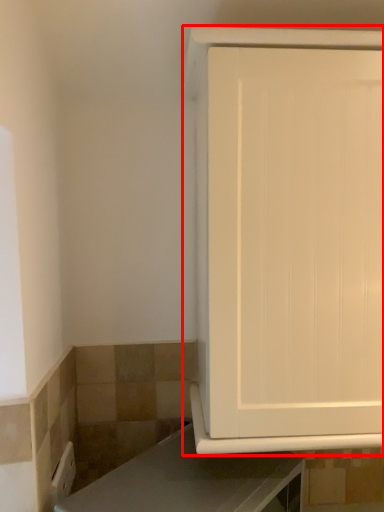
Question: From the image's perspective, what is the correct spatial positioning of cabinetry (annotated by the red box) in reference to countertop?

Choices:
 (A) above
 (B) below

Answer: (A)